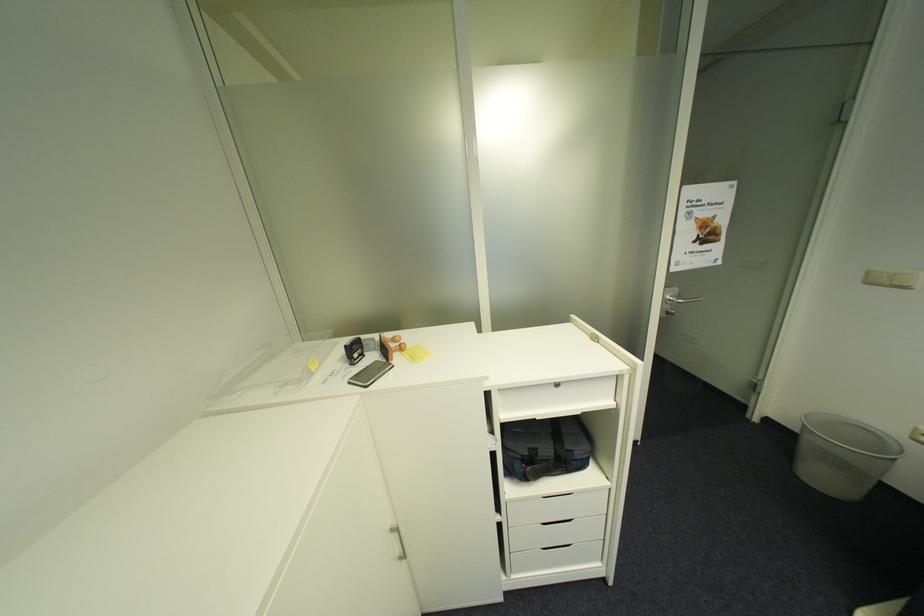
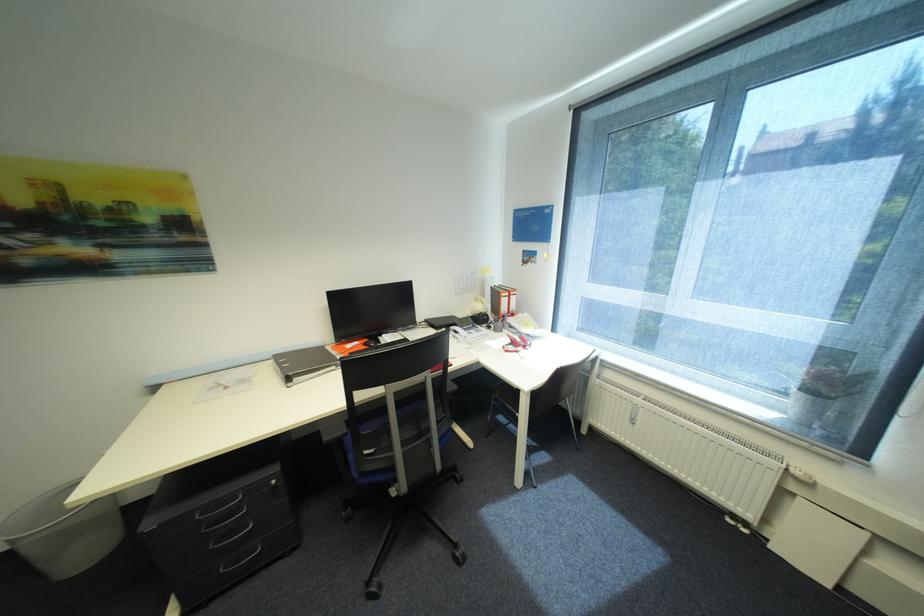
Based on the continuous images, in which direction is the camera rotating?

The camera's rotation is toward right-down.